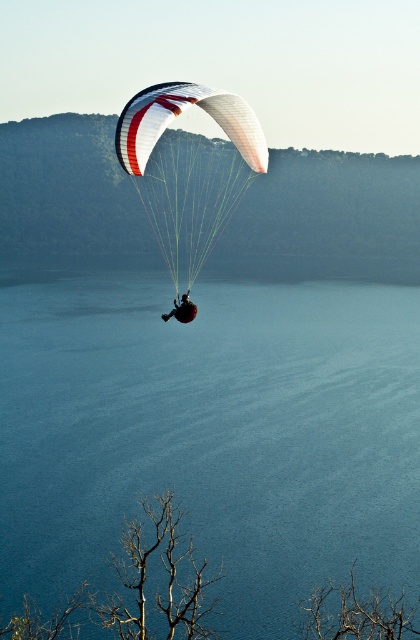
Based on the photo, does blue water at center appear under white matte parachute at center?

Yes, blue water at center is below white matte parachute at center.

At what (x,y) coordinates should I click in order to perform the action: click on blue water at center. Please return your answer as a coordinate pair (x, y). The image size is (420, 640). Looking at the image, I should click on (210, 433).

You are a GUI agent. You are given a task and a screenshot of the screen. Output one action in this format:
    pyautogui.click(x=<x>, y=<y>)
    Task: Click on the blue water at center
    The image size is (420, 640).
    Given the screenshot: What is the action you would take?
    pyautogui.click(x=210, y=433)

Which is behind, point (220, 116) or point (181, 308)?

The point (181, 308) is more distant.

How much distance is there between white matte parachute at center and matte black parachute at center?

white matte parachute at center is 65.30 meters away from matte black parachute at center.

This screenshot has height=640, width=420. Describe the element at coordinates (189, 168) in the screenshot. I see `white matte parachute at center` at that location.

You are a GUI agent. You are given a task and a screenshot of the screen. Output one action in this format:
    pyautogui.click(x=<x>, y=<y>)
    Task: Click on the white matte parachute at center
    This screenshot has height=640, width=420.
    Given the screenshot: What is the action you would take?
    pyautogui.click(x=189, y=168)

Between green leafy tree at center and matte black parachute at center, which one has more height?

With more height is green leafy tree at center.

Looking at this image, does green leafy tree at center have a lesser height compared to matte black parachute at center?

No, green leafy tree at center is not shorter than matte black parachute at center.

Does point (125, 234) lie behind point (170, 314)?

Yes, it is.

Find the location of a particular element. The image size is (420, 640). green leafy tree at center is located at coordinates (325, 220).